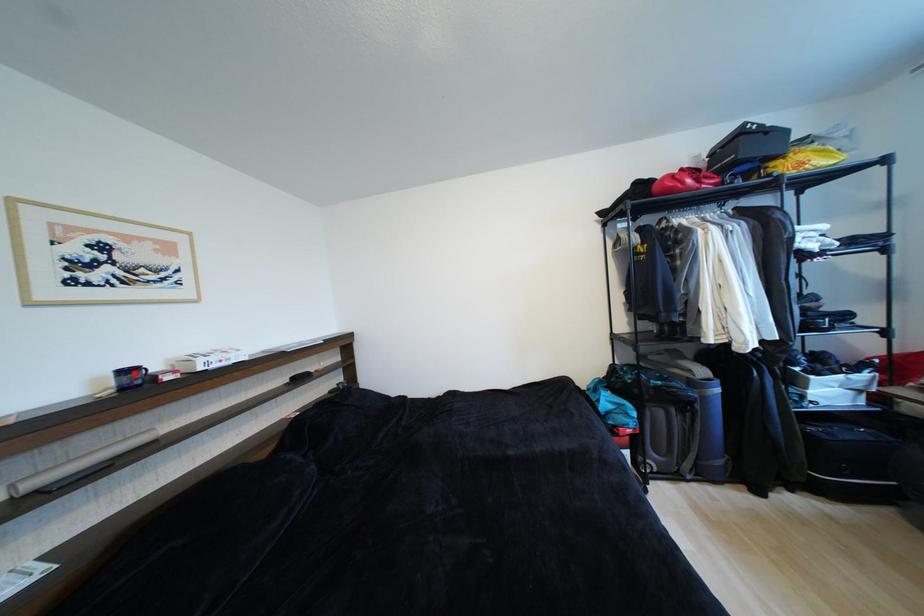
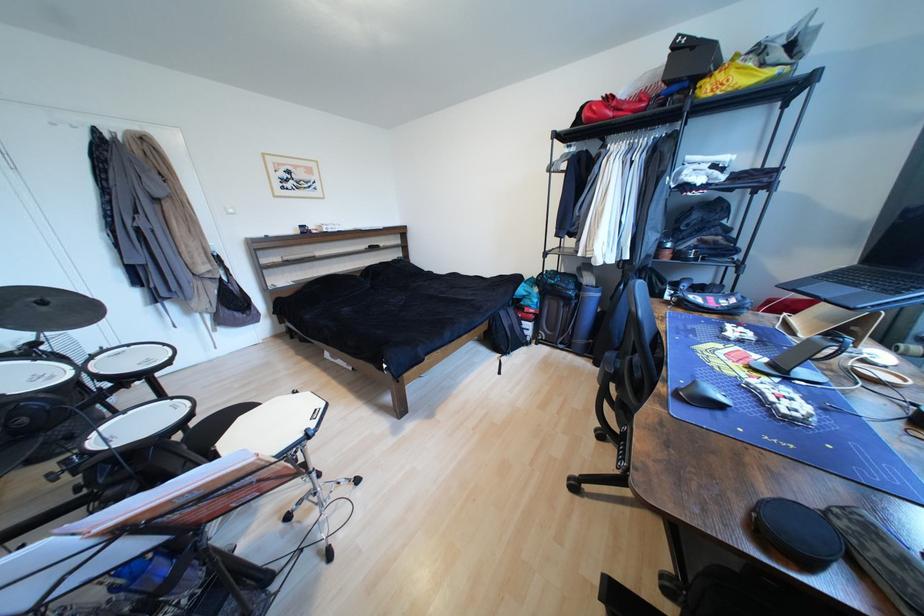
Question: I am providing you with two images of the same scene from different viewpoints. A red point is shown in image1. For the corresponding object point in image2, is it positioned nearer or farther from the camera?

Choices:
 (A) Nearer
 (B) Farther

Answer: (A)